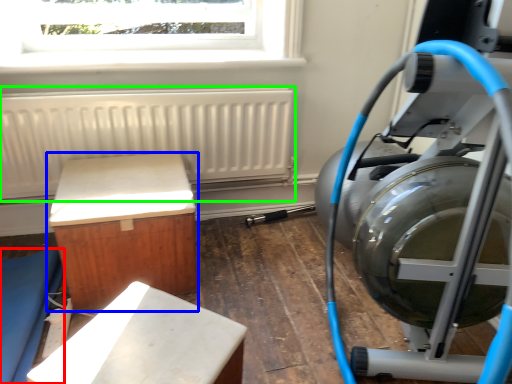
Question: Which is farther away from furniture (highlighted by a red box)? furniture (highlighted by a blue box) or radiator (highlighted by a green box)?

Choices:
 (A) furniture
 (B) radiator

Answer: (B)